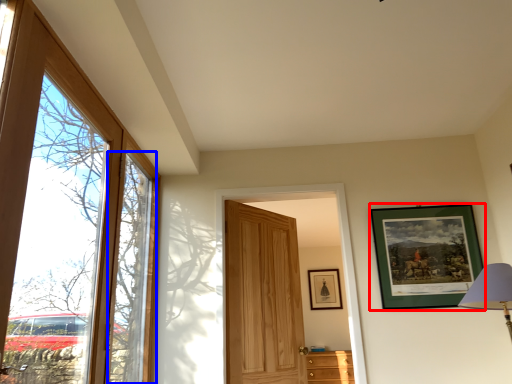
Question: Which point is further to the camera, picture frame (highlighted by a red box) or window (highlighted by a blue box)?

Choices:
 (A) picture frame
 (B) window

Answer: (A)